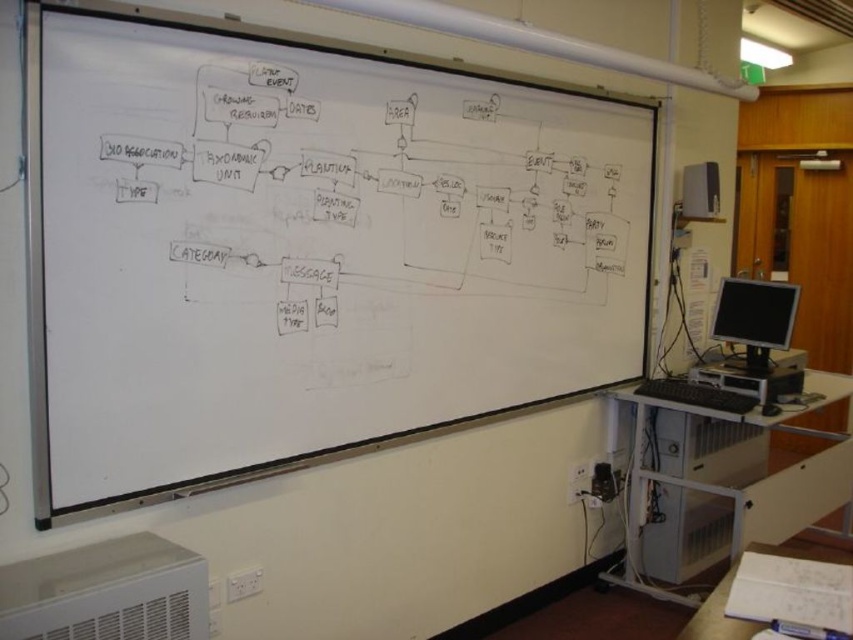
Can you confirm if white matte board at center is wider than metallic gray computer tower at lower right?

Indeed, white matte board at center has a greater width compared to metallic gray computer tower at lower right.

Which is more to the left, white matte board at center or metallic gray computer tower at lower right?

Positioned to the left is white matte board at center.

Find the location of a particular element. white matte board at center is located at coordinates (306, 248).

Between black glossy monitor at right and white paper at lower right, which one appears on the right side from the viewer's perspective?

black glossy monitor at right is more to the right.

Is point (733, 340) less distant than point (775, 554)?

No.

Which is in front, point (759, 332) or point (738, 628)?

Point (738, 628) is in front.

Find the location of a particular element. black glossy monitor at right is located at coordinates (x=755, y=317).

Can you confirm if white matte board at center is positioned above white paper at lower right?

Correct, white matte board at center is located above white paper at lower right.

Which is more to the right, white matte board at center or white paper at lower right?

white paper at lower right is more to the right.

Where is `white matte board at center`? This screenshot has width=853, height=640. white matte board at center is located at coordinates (306, 248).